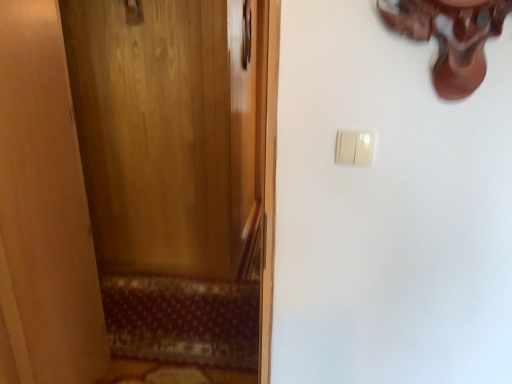
Question: Is patterned carpet at lower left not within polished brass door handle at upper left?

Choices:
 (A) no
 (B) yes

Answer: (B)

Question: Is patterned carpet at lower left further to camera compared to polished brass door handle at upper left?

Choices:
 (A) yes
 (B) no

Answer: (B)

Question: From a real-world perspective, is patterned carpet at lower left over polished brass door handle at upper left?

Choices:
 (A) yes
 (B) no

Answer: (B)

Question: From a real-world perspective, is patterned carpet at lower left physically below polished brass door handle at upper left?

Choices:
 (A) no
 (B) yes

Answer: (B)

Question: Is patterned carpet at lower left to the left of polished brass door handle at upper left from the viewer's perspective?

Choices:
 (A) no
 (B) yes

Answer: (A)

Question: From the image's perspective, would you say patterned carpet at lower left is positioned over polished brass door handle at upper left?

Choices:
 (A) yes
 (B) no

Answer: (B)

Question: Is polished brass door handle at upper left in contact with white plastic light switch at upper right?

Choices:
 (A) yes
 (B) no

Answer: (B)

Question: Is polished brass door handle at upper left looking in the opposite direction of white plastic light switch at upper right?

Choices:
 (A) no
 (B) yes

Answer: (A)

Question: Is polished brass door handle at upper left smaller than white plastic light switch at upper right?

Choices:
 (A) no
 (B) yes

Answer: (A)

Question: Can you confirm if polished brass door handle at upper left is taller than white plastic light switch at upper right?

Choices:
 (A) yes
 (B) no

Answer: (A)

Question: From a real-world perspective, is polished brass door handle at upper left positioned under white plastic light switch at upper right based on gravity?

Choices:
 (A) yes
 (B) no

Answer: (B)

Question: Considering the relative sizes of polished brass door handle at upper left and white plastic light switch at upper right in the image provided, is polished brass door handle at upper left thinner than white plastic light switch at upper right?

Choices:
 (A) yes
 (B) no

Answer: (B)

Question: Is polished brass door handle at upper left positioned in front of patterned carpet at lower left?

Choices:
 (A) yes
 (B) no

Answer: (B)